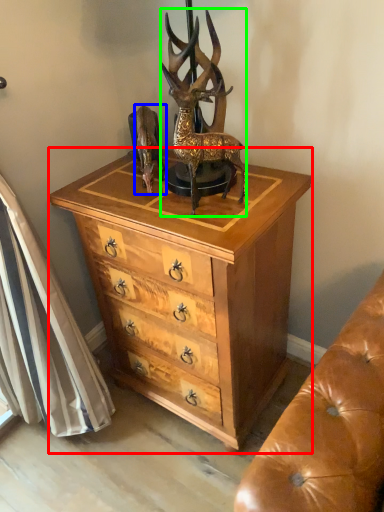
Question: Estimate the real-world distances between objects in this image. Which object is farther from chest of drawers (highlighted by a red box), animal (highlighted by a blue box) or deer (highlighted by a green box)?

Choices:
 (A) animal
 (B) deer

Answer: (A)